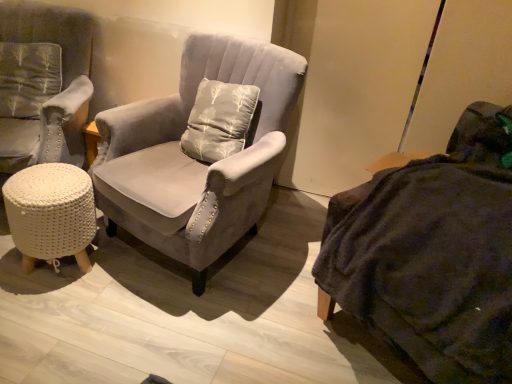
Describe the element at coordinates (195, 160) in the screenshot. This screenshot has width=512, height=384. I see `suede gray armchair at center, marked as the 2th chair in a left-to-right arrangement` at that location.

What do you see at coordinates (42, 84) in the screenshot? The image size is (512, 384). I see `velvet gray armchair at left, marked as the second chair in a right-to-left arrangement` at bounding box center [42, 84].

The height and width of the screenshot is (384, 512). Find the location of `dark gray fabric couch at right`. dark gray fabric couch at right is located at coordinates (433, 253).

From the image's perspective, is white knitted stool at lower left beneath velvet gray armchair at left, marked as the second chair in a right-to-left arrangement?

Yes, from the image's perspective, white knitted stool at lower left is beneath velvet gray armchair at left, marked as the second chair in a right-to-left arrangement.

Who is bigger, white knitted stool at lower left or velvet gray armchair at left, which ranks as the 1th chair in left-to-right order?

velvet gray armchair at left, which ranks as the 1th chair in left-to-right order.

Which is nearer, (46, 217) or (59, 95)?

Clearly, point (46, 217) is closer to the camera than point (59, 95).

In the image, is velvet gray armchair at left, marked as the second chair in a right-to-left arrangement, positioned in front of or behind white knitted stool at lower left?

In the image, velvet gray armchair at left, marked as the second chair in a right-to-left arrangement, appears in front of white knitted stool at lower left.

Is point (68, 149) positioned in front of point (31, 255)?

No.

Is velvet gray armchair at left, which ranks as the 1th chair in left-to-right order, touching white knitted stool at lower left?

No, velvet gray armchair at left, which ranks as the 1th chair in left-to-right order, is not touching white knitted stool at lower left.

Is white knitted stool at lower left completely or partially inside dark gray fabric couch at right?

No.

In the image, is dark gray fabric couch at right positioned in front of or behind white knitted stool at lower left?

Clearly, dark gray fabric couch at right is in front of white knitted stool at lower left.

Could you tell me if dark gray fabric couch at right is facing white knitted stool at lower left?

No, dark gray fabric couch at right does not turn towards white knitted stool at lower left.

Considering the positions of objects dark gray fabric couch at right and white knitted stool at lower left in the image provided, who is more to the left, dark gray fabric couch at right or white knitted stool at lower left?

white knitted stool at lower left.

In terms of width, does white knitted stool at lower left look wider or thinner when compared to suede gray armchair at center, marked as the 2th chair in a left-to-right arrangement?

white knitted stool at lower left is thinner than suede gray armchair at center, marked as the 2th chair in a left-to-right arrangement.

Is white knitted stool at lower left taller than suede gray armchair at center, marked as the 2th chair in a left-to-right arrangement?

Incorrect, the height of white knitted stool at lower left is not larger of that of suede gray armchair at center, marked as the 2th chair in a left-to-right arrangement.

Is white knitted stool at lower left bigger or smaller than suede gray armchair at center, the 1th chair viewed from the right?

Considering their sizes, white knitted stool at lower left takes up less space than suede gray armchair at center, the 1th chair viewed from the right.

From a real-world perspective, is white knitted stool at lower left over suede gray armchair at center, the 1th chair viewed from the right?

No, from a real-world perspective, white knitted stool at lower left is not above suede gray armchair at center, the 1th chair viewed from the right.

How many degrees apart are the facing directions of dark gray fabric couch at right and velvet gray armchair at left, marked as the second chair in a right-to-left arrangement?

The facing directions of dark gray fabric couch at right and velvet gray armchair at left, marked as the second chair in a right-to-left arrangement, are 55.5 degrees apart.

Is dark gray fabric couch at right facing away from velvet gray armchair at left, marked as the second chair in a right-to-left arrangement?

dark gray fabric couch at right does not have its back to velvet gray armchair at left, marked as the second chair in a right-to-left arrangement.

Which object is further away from the camera, dark gray fabric couch at right or velvet gray armchair at left, which ranks as the 1th chair in left-to-right order?

velvet gray armchair at left, which ranks as the 1th chair in left-to-right order, is more distant.

Does point (402, 233) appear closer or farther from the camera than point (0, 121)?

Point (402, 233).

Locate an element on the screen. The width and height of the screenshot is (512, 384). the 1st chair positioned below the dark gray fabric couch at right (from a real-world perspective) is located at coordinates (42, 84).

Is velvet gray armchair at left, which ranks as the 1th chair in left-to-right order, positioned beyond the bounds of dark gray fabric couch at right?

That's correct, velvet gray armchair at left, which ranks as the 1th chair in left-to-right order, is outside of dark gray fabric couch at right.

Is velvet gray armchair at left, marked as the second chair in a right-to-left arrangement, positioned far away from dark gray fabric couch at right?

Yes, velvet gray armchair at left, marked as the second chair in a right-to-left arrangement, and dark gray fabric couch at right are located far from each other.

From a real-world perspective, which is physically above, suede gray armchair at center, the 1th chair viewed from the right, or velvet gray armchair at left, marked as the second chair in a right-to-left arrangement?

velvet gray armchair at left, marked as the second chair in a right-to-left arrangement.

Between suede gray armchair at center, marked as the 2th chair in a left-to-right arrangement, and velvet gray armchair at left, marked as the second chair in a right-to-left arrangement, which one has larger size?

velvet gray armchair at left, marked as the second chair in a right-to-left arrangement, is bigger.

Can you confirm if suede gray armchair at center, marked as the 2th chair in a left-to-right arrangement, is thinner than velvet gray armchair at left, marked as the second chair in a right-to-left arrangement?

Yes.

Where is `chair that is the 2nd one when counting upward from the white knitted stool at lower left (from the image's perspective)`? chair that is the 2nd one when counting upward from the white knitted stool at lower left (from the image's perspective) is located at coordinates (42, 84).

You are a GUI agent. You are given a task and a screenshot of the screen. Output one action in this format:
    pyautogui.click(x=<x>, y=<y>)
    Task: Click on the table beneath the velvet gray armchair at left, marked as the second chair in a right-to-left arrangement (from a real-world perspective)
    This screenshot has width=512, height=384.
    Given the screenshot: What is the action you would take?
    pyautogui.click(x=51, y=213)

Looking at the image, which one is located further to white knitted stool at lower left, velvet gray armchair at left, which ranks as the 1th chair in left-to-right order, or suede gray armchair at center, the 1th chair viewed from the right?

velvet gray armchair at left, which ranks as the 1th chair in left-to-right order.

Estimate the real-world distances between objects in this image. Which object is closer to suede gray armchair at center, the 1th chair viewed from the right, white knitted stool at lower left or velvet gray armchair at left, which ranks as the 1th chair in left-to-right order?

white knitted stool at lower left is positioned closer to the anchor suede gray armchair at center, the 1th chair viewed from the right.

Looking at this image, considering their positions, is suede gray armchair at center, marked as the 2th chair in a left-to-right arrangement, positioned closer to velvet gray armchair at left, which ranks as the 1th chair in left-to-right order, than white knitted stool at lower left?

white knitted stool at lower left is positioned closer to the anchor velvet gray armchair at left, which ranks as the 1th chair in left-to-right order.

From the image, which object appears to be nearer to white knitted stool at lower left, dark gray fabric couch at right or velvet gray armchair at left, which ranks as the 1th chair in left-to-right order?

velvet gray armchair at left, which ranks as the 1th chair in left-to-right order, lies closer to white knitted stool at lower left than the other object.

Which object lies further to the anchor point dark gray fabric couch at right, white knitted stool at lower left or velvet gray armchair at left, marked as the second chair in a right-to-left arrangement?

velvet gray armchair at left, marked as the second chair in a right-to-left arrangement, lies further to dark gray fabric couch at right than the other object.

Which object lies nearer to the anchor point velvet gray armchair at left, which ranks as the 1th chair in left-to-right order, suede gray armchair at center, the 1th chair viewed from the right, or dark gray fabric couch at right?

suede gray armchair at center, the 1th chair viewed from the right, lies closer to velvet gray armchair at left, which ranks as the 1th chair in left-to-right order, than the other object.

From the image, which object appears to be nearer to velvet gray armchair at left, marked as the second chair in a right-to-left arrangement, dark gray fabric couch at right or white knitted stool at lower left?

The object closer to velvet gray armchair at left, marked as the second chair in a right-to-left arrangement, is white knitted stool at lower left.

In the scene shown: From the image, which object appears to be farther from white knitted stool at lower left, suede gray armchair at center, the 1th chair viewed from the right, or velvet gray armchair at left, marked as the second chair in a right-to-left arrangement?

velvet gray armchair at left, marked as the second chair in a right-to-left arrangement, lies further to white knitted stool at lower left than the other object.

Locate an element on the screen. The width and height of the screenshot is (512, 384). table situated between velvet gray armchair at left, which ranks as the 1th chair in left-to-right order, and dark gray fabric couch at right from left to right is located at coordinates (51, 213).

Identify the location of chair between velvet gray armchair at left, which ranks as the 1th chair in left-to-right order, and dark gray fabric couch at right from left to right. (195, 160).

Identify the location of table situated between velvet gray armchair at left, marked as the second chair in a right-to-left arrangement, and suede gray armchair at center, marked as the 2th chair in a left-to-right arrangement, from left to right. (51, 213).

This screenshot has width=512, height=384. I want to click on chair located between white knitted stool at lower left and dark gray fabric couch at right in the left-right direction, so click(x=195, y=160).